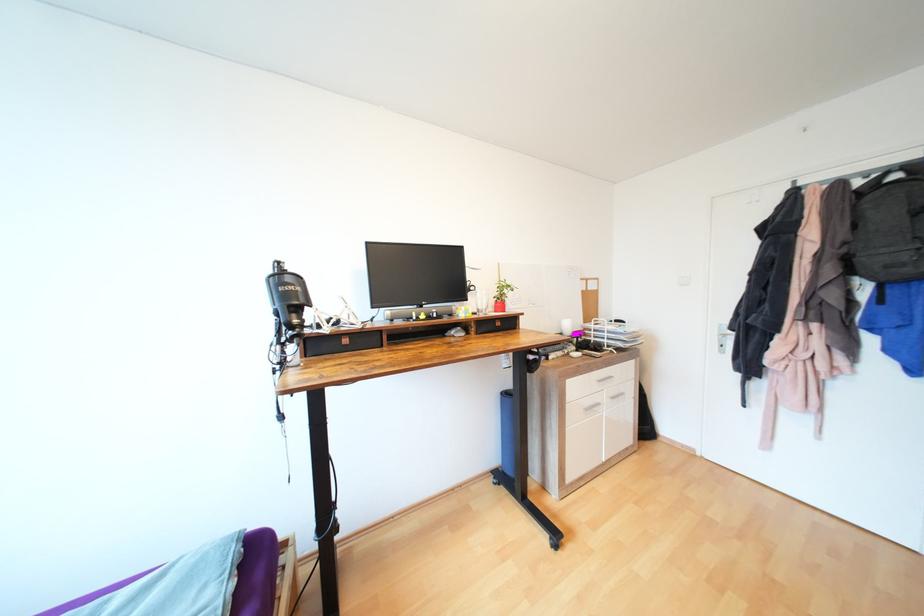
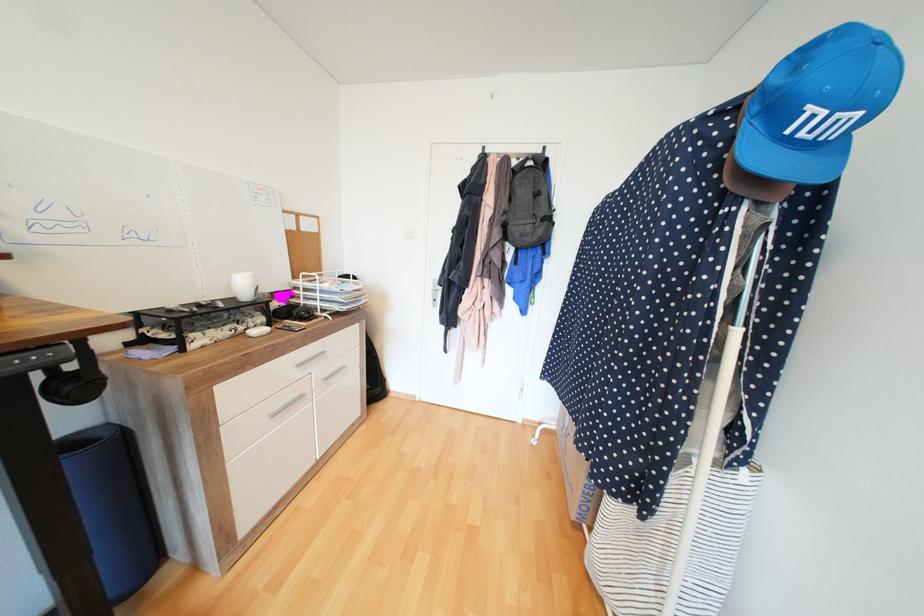
Find the pixel in the second image that matches (x=850, y=244) in the first image.

(511, 213)